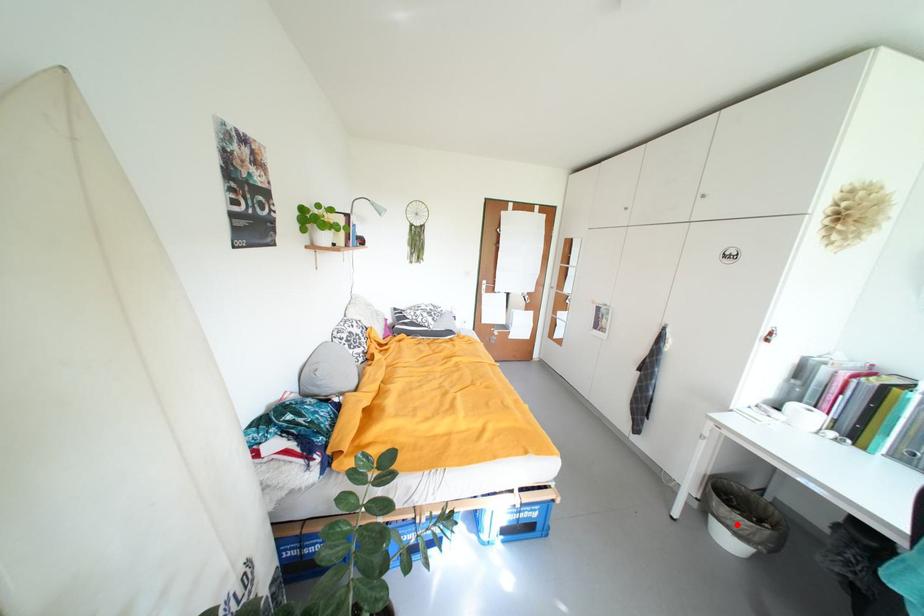
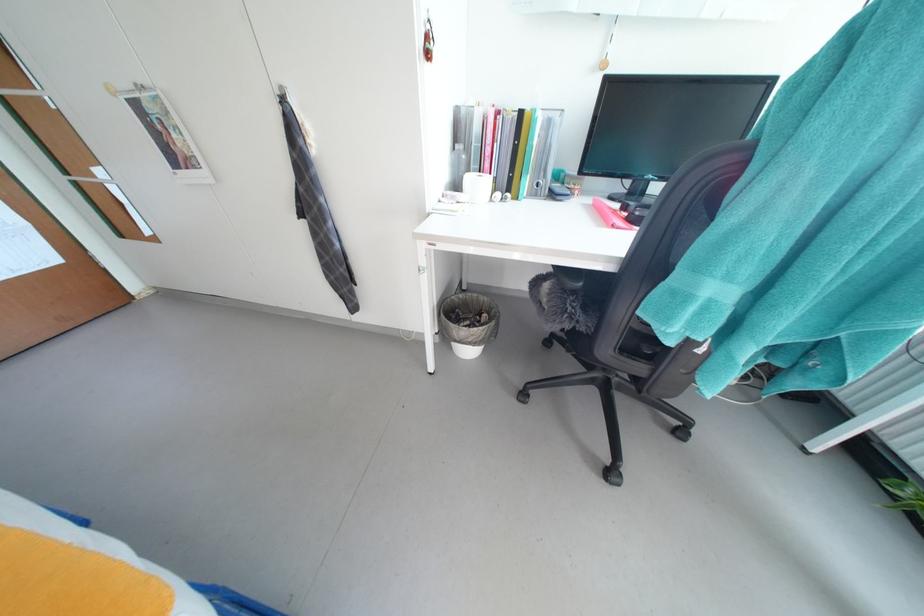
In the second image, find the point that corresponds to the highlighted location in the first image.

(478, 342)